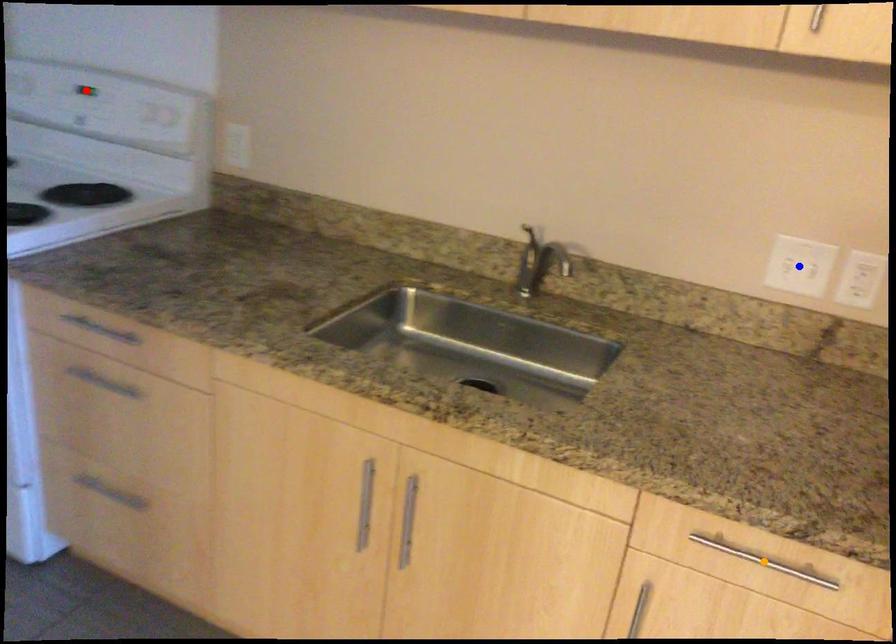
Order these from nearest to farthest:
red point
orange point
blue point

orange point
blue point
red point